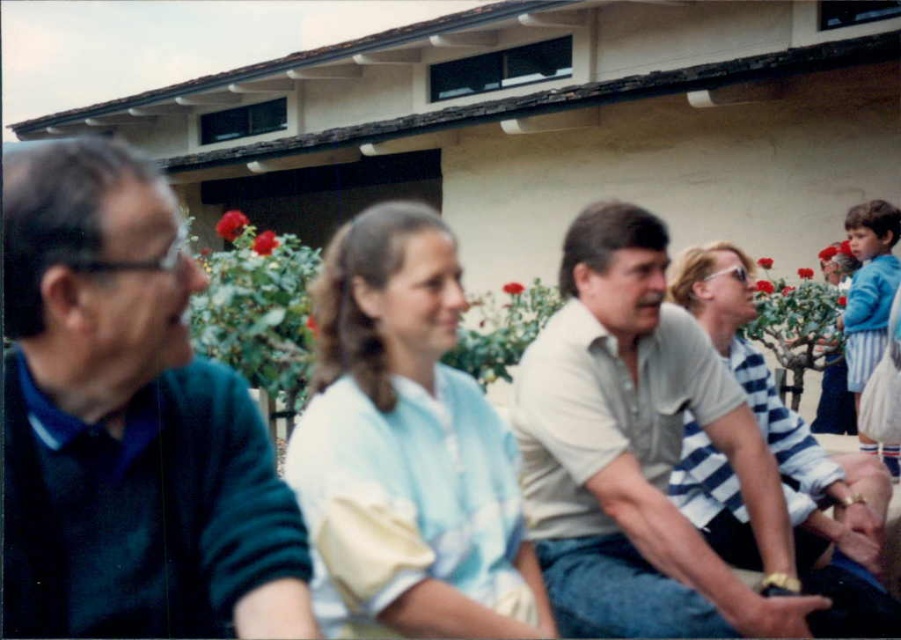
Between dark blue sweater at left and white striped shirt at right, which one has less height?

Standing shorter between the two is dark blue sweater at left.

Between dark blue sweater at left and white striped shirt at right, which one is positioned lower?

white striped shirt at right is lower down.

Locate an element on the screen. Image resolution: width=901 pixels, height=640 pixels. dark blue sweater at left is located at coordinates (126, 422).

This screenshot has height=640, width=901. In order to click on dark blue sweater at left in this screenshot , I will do `click(126, 422)`.

Which is behind, point (241, 582) or point (531, 394)?

The point (531, 394) is behind.

Describe the element at coordinates (126, 422) in the screenshot. I see `dark blue sweater at left` at that location.

In order to click on dark blue sweater at left in this screenshot , I will do `click(126, 422)`.

From the picture: Can you confirm if light beige shirt at center is positioned to the left of light blue fabric shirt at center?

Incorrect, light beige shirt at center is not on the left side of light blue fabric shirt at center.

In the scene shown: Is light beige shirt at center below light blue fabric shirt at center?

No, light beige shirt at center is not below light blue fabric shirt at center.

Does point (681, 397) lie behind point (293, 477)?

Yes, it is.

At what (x,y) coordinates should I click in order to perform the action: click on light beige shirt at center. Please return your answer as a coordinate pair (x, y). Looking at the image, I should click on (638, 451).